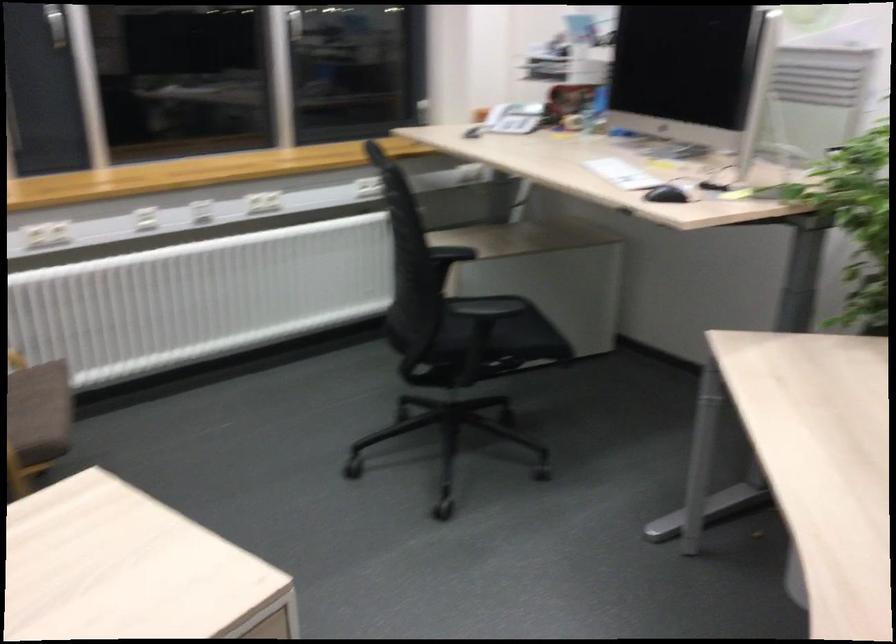
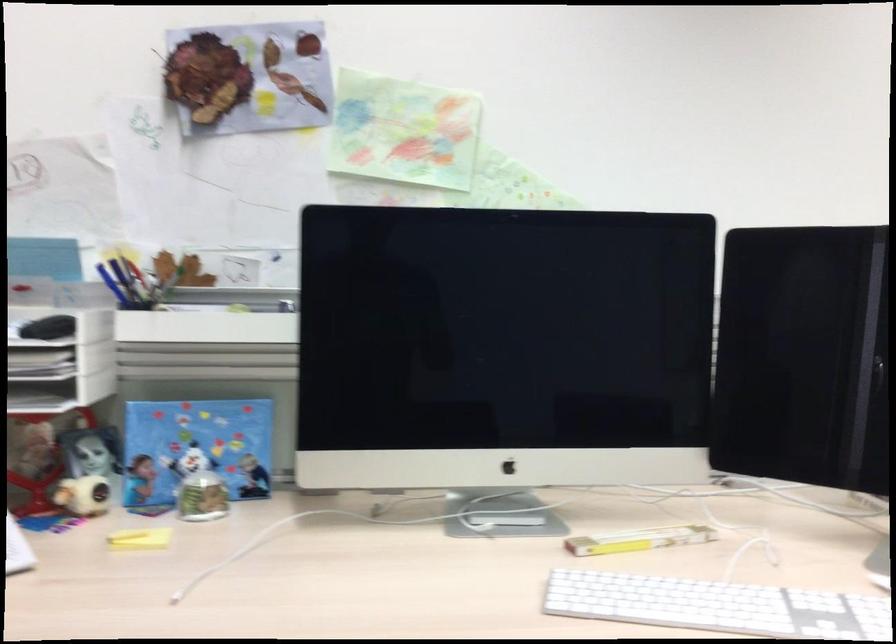
Locate, in the second image, the point that corresponds to the point at 688,144 in the first image.

(449, 494)